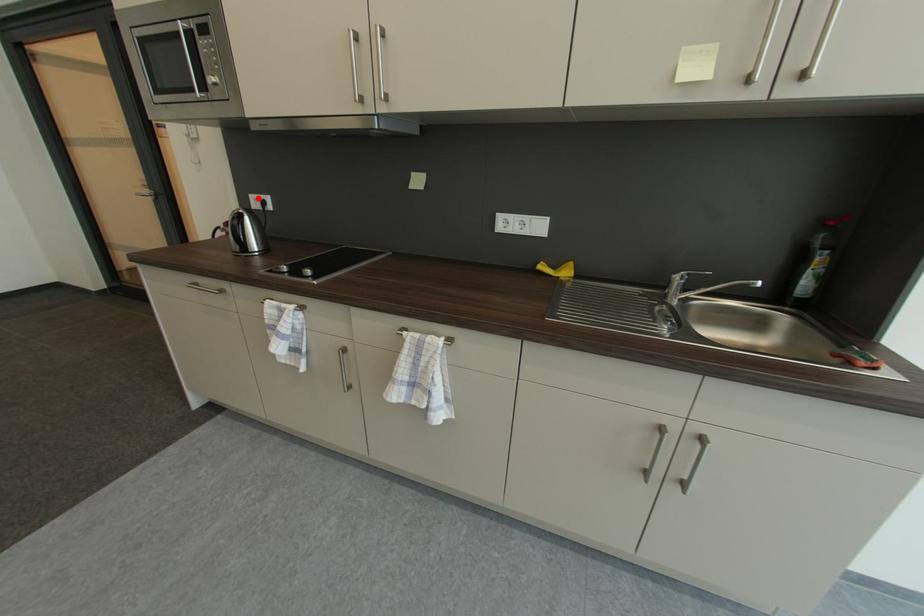
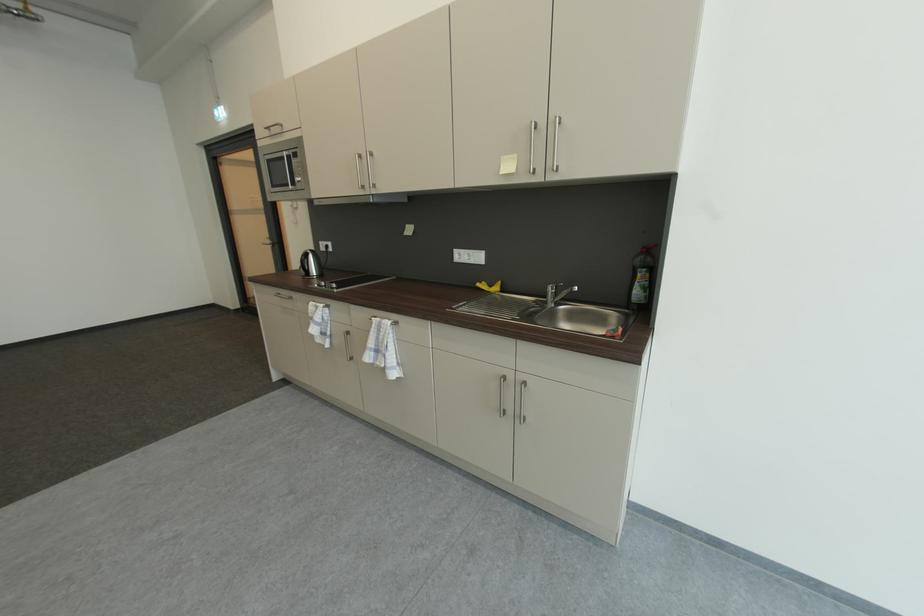
The point at the highlighted location is marked in the first image. Where is the corresponding point in the second image?

(327, 245)